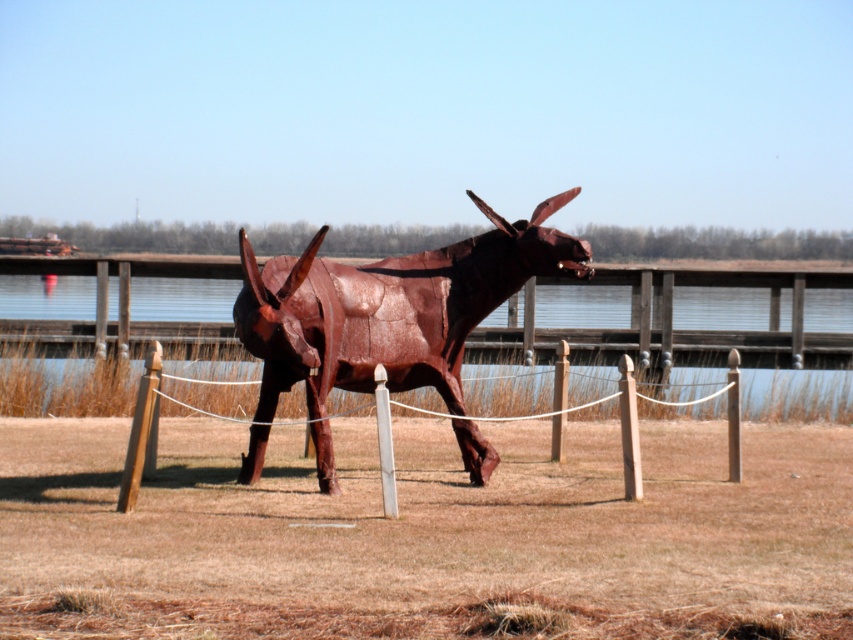
In the scene shown: Between rusty metal bull at center and wooden post at center, which one has less height?

wooden post at center is shorter.

Is rusty metal bull at center closer to the viewer compared to wooden post at center?

Yes, it is in front of wooden post at center.

Find the location of `rusty metal bull at center`. rusty metal bull at center is located at coordinates (389, 308).